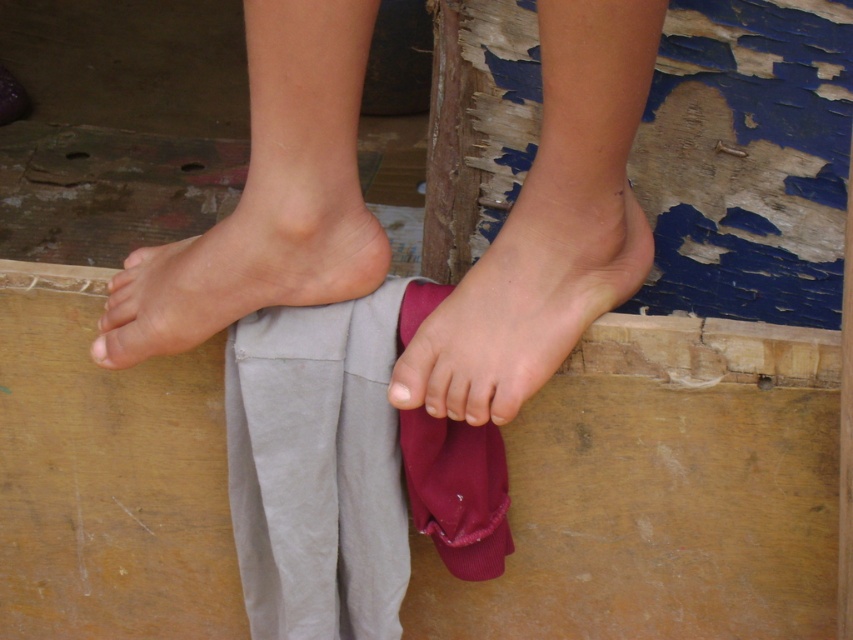
Can you confirm if maroon fabric at lower center is smaller than pink soft skin at center?

No.

From the picture: Who is taller, maroon fabric at lower center or pink soft skin at center?

Standing taller between the two is maroon fabric at lower center.

Describe the element at coordinates (457, 490) in the screenshot. I see `maroon fabric at lower center` at that location.

Locate an element on the screen. The image size is (853, 640). maroon fabric at lower center is located at coordinates (457, 490).

Who is more distant from viewer, (608, 64) or (399, 403)?

The point (399, 403) is more distant.

Can you confirm if smooth skin foot at center is positioned to the left of pink soft skin at center?

No, smooth skin foot at center is not to the left of pink soft skin at center.

Where is `smooth skin foot at center`? The image size is (853, 640). smooth skin foot at center is located at coordinates (531, 292).

Does point (334, 100) come closer to viewer compared to point (392, 387)?

Yes, point (334, 100) is in front of point (392, 387).

Can you confirm if smooth skin feet at center is positioned to the right of pink soft skin at center?

Incorrect, smooth skin feet at center is not on the right side of pink soft skin at center.

The width and height of the screenshot is (853, 640). Describe the element at coordinates (550, 225) in the screenshot. I see `smooth skin feet at center` at that location.

At what (x,y) coordinates should I click in order to perform the action: click on smooth skin feet at center. Please return your answer as a coordinate pair (x, y). Looking at the image, I should click on (550, 225).